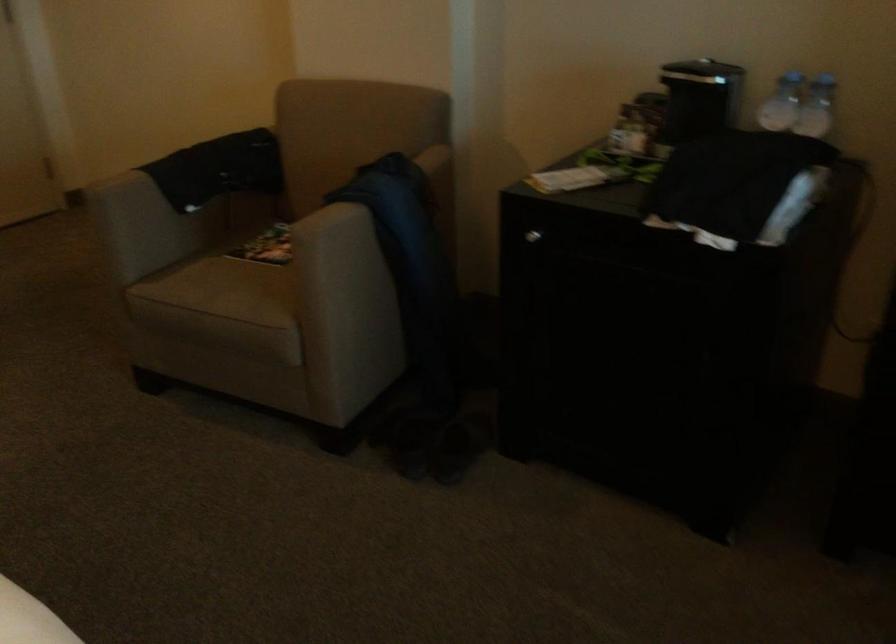
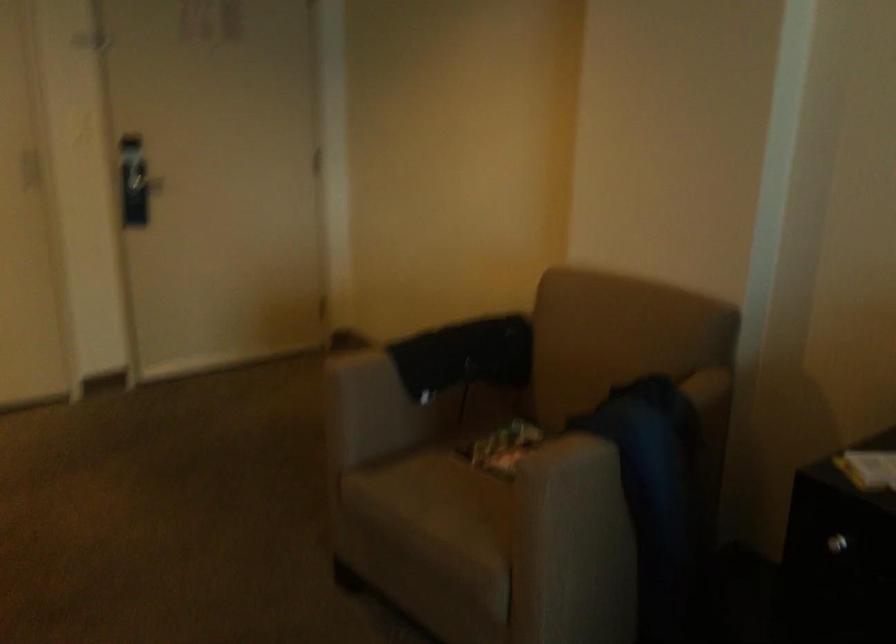
Locate, in the second image, the point that corresponds to point 235,285 in the first image.

(453, 500)